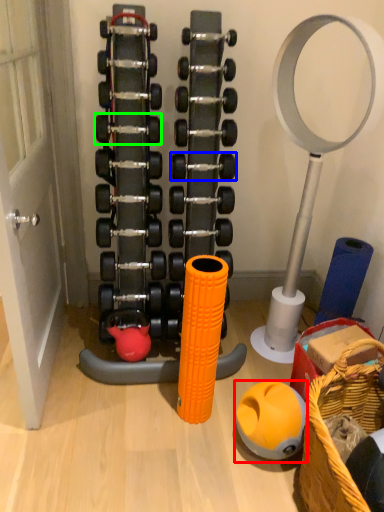
Question: Which is farther away from ball (highlighted by a red box)? dumbbell (highlighted by a blue box) or dumbbell (highlighted by a green box)?

Choices:
 (A) dumbbell
 (B) dumbbell

Answer: (B)